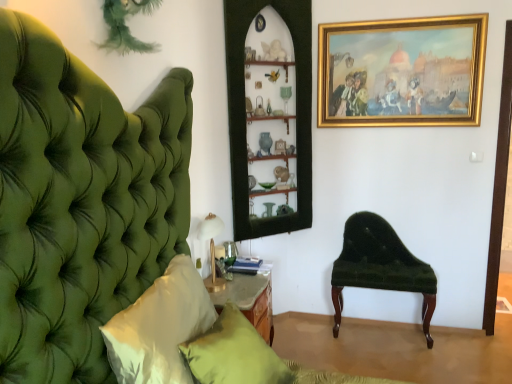
Question: In terms of width, does velvet green bench at right look wider or thinner when compared to matte green pillow at lower center, acting as the second pillow starting from the front?

Choices:
 (A) thin
 (B) wide

Answer: (A)

Question: In the image, is velvet green bench at right on the left side or the right side of matte green pillow at lower center, which appears as the first pillow when viewed from the back?

Choices:
 (A) right
 (B) left

Answer: (A)

Question: Based on their relative distances, which object is farther from the velvet green bench at right?

Choices:
 (A) gold/gilded picture frame at upper right
 (B) gold metallic table lamp at lower left
 (C) wooden shelves at center
 (D) matte green pillow at lower center, acting as the second pillow starting from the front
 (E) white satin pillow at left, which is the second pillow from back to front

Answer: (E)

Question: Which object is the farthest from the gold metallic table lamp at lower left?

Choices:
 (A) white satin pillow at left, the 1th pillow viewed from the front
 (B) gold/gilded picture frame at upper right
 (C) velvet green bench at right
 (D) matte green pillow at lower center, which appears as the first pillow when viewed from the back
 (E) wooden shelves at center

Answer: (B)